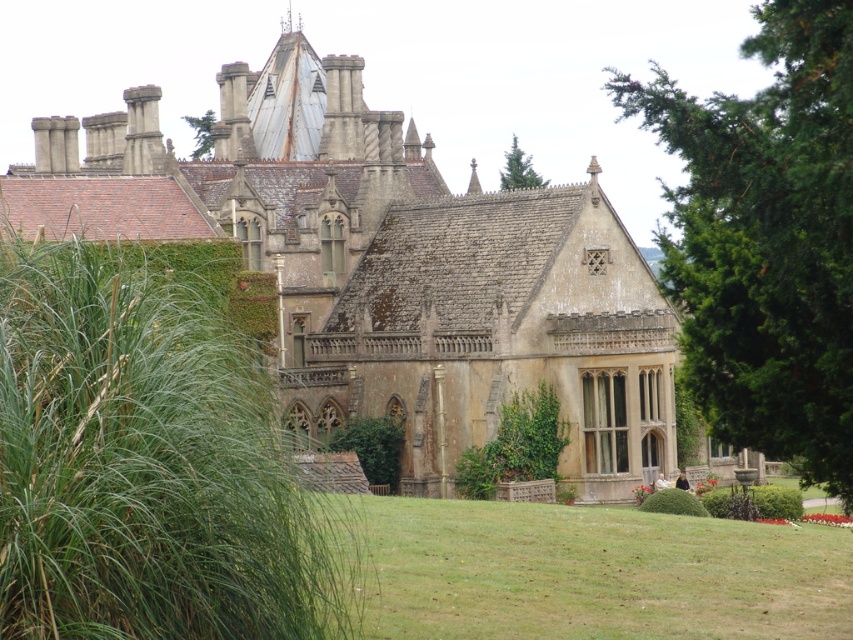
You are an architect analyzing the symmetry of the building. You notice two green leafy trees in the upper part of the image. Which tree has a wider spread? The options are the green leafy tree at upper right and the green leafy tree at upper center.

The green leafy tree at upper right has a wider spread than the green leafy tree at upper center.